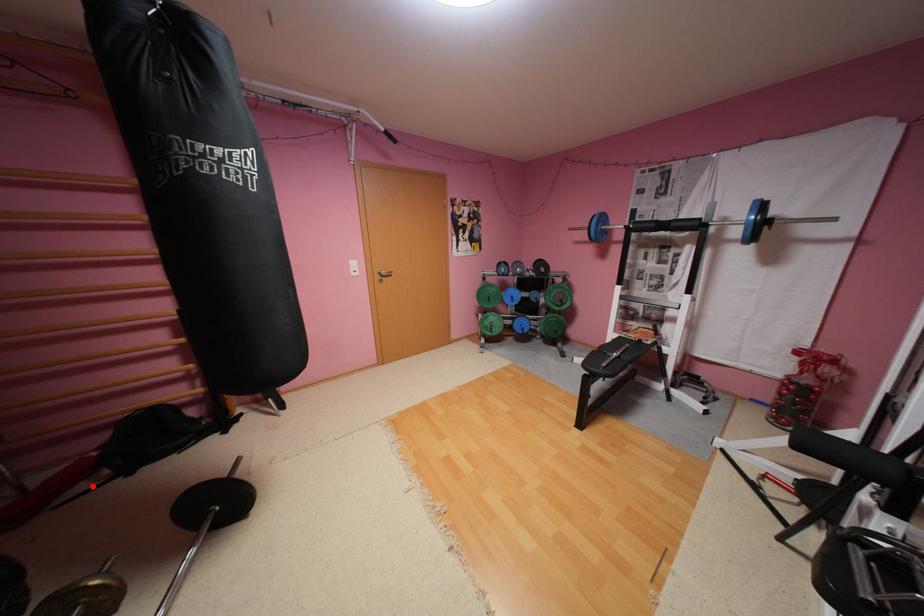
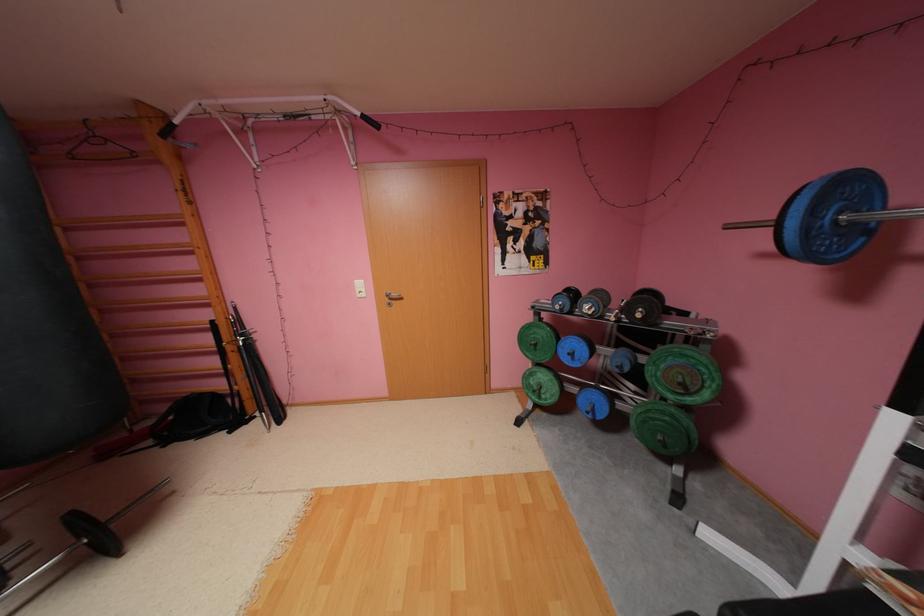
Question: I am providing you with two images of the same scene from different viewpoints. Image1 has a red point marked. In image2, the corresponding 3D location appears at what relative position? Reply with the corresponding letter.

Choices:
 (A) Closer
 (B) Farther

Answer: (A)